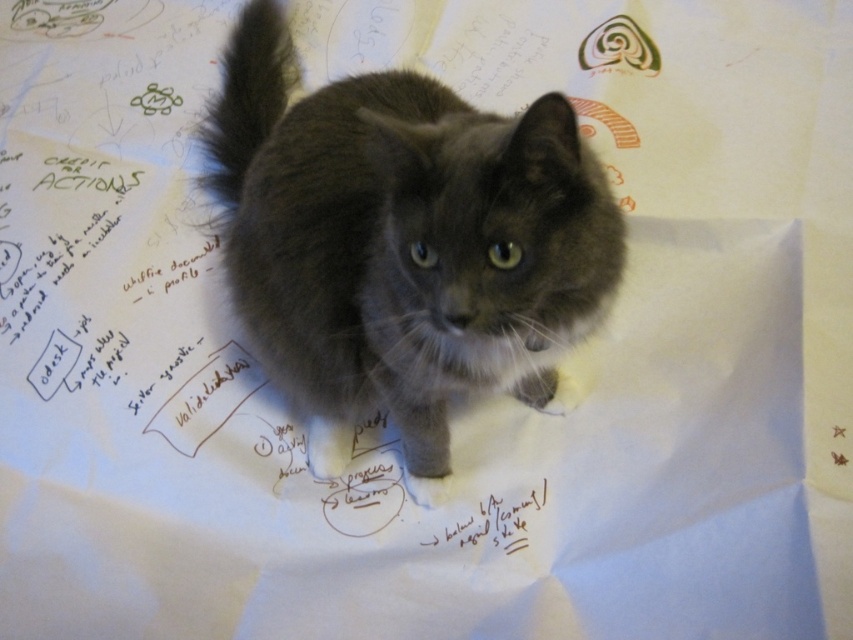
You are a photographer trying to capture the gray fluffy cat at center and the gray fluffy tail at upper center in a single shot. Based on their positions, can you determine which one is closer to the camera?

The gray fluffy cat at center is taller than the gray fluffy tail at upper center in the image, which suggests that the gray fluffy tail at upper center is closer to the camera than the gray fluffy cat at center.

You are a photographer trying to capture the gray fluffy cat at center in the image. The camera you are using has a focus point at coordinate point [401,241]. Will this focus point help you capture the cat clearly?

The gray fluffy cat at center is represented by point [401,241], so yes, the focus point at coordinate point [401,241] will help capture the cat clearly.